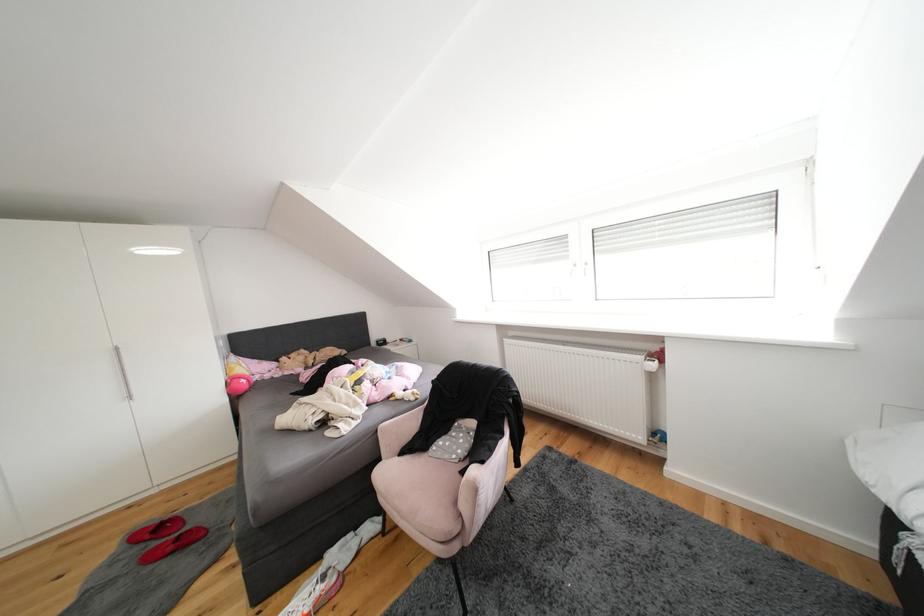
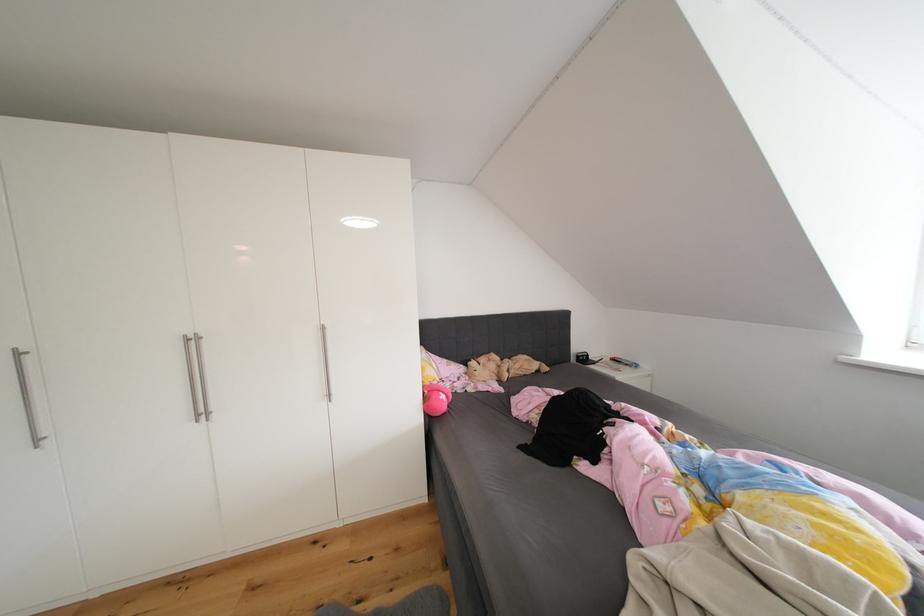
Consider the image. The images are taken continuously from a first-person perspective. In which direction are you moving?

The cameraman walked toward left, forward.